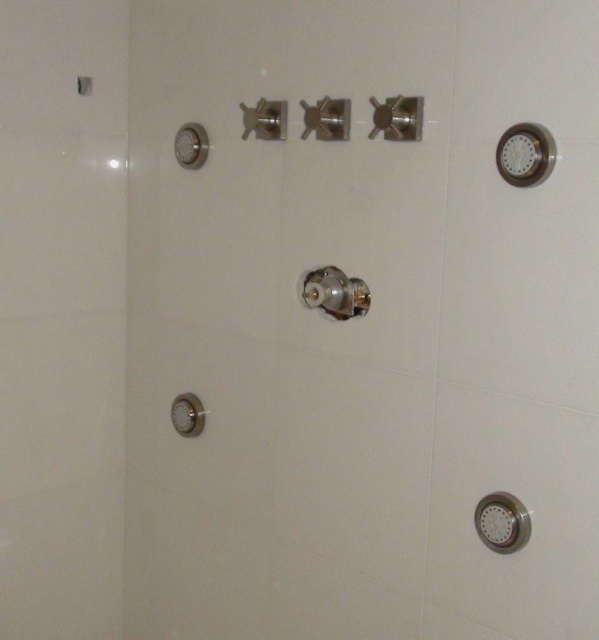
Question: Does polished chrome shower at center have a greater width compared to matte silver shower handle at lower left?

Choices:
 (A) yes
 (B) no

Answer: (A)

Question: Which point is closer to the camera?

Choices:
 (A) polished chrome shower at center
 (B) matte silver shower handle at lower left

Answer: (A)

Question: Can you confirm if polished chrome shower at center is wider than matte silver shower handle at lower left?

Choices:
 (A) no
 (B) yes

Answer: (B)

Question: Can you confirm if polished chrome shower at center is positioned above matte silver shower handle at lower left?

Choices:
 (A) yes
 (B) no

Answer: (A)

Question: Which point is closer to the camera taking this photo?

Choices:
 (A) (328, 276)
 (B) (176, 419)

Answer: (A)